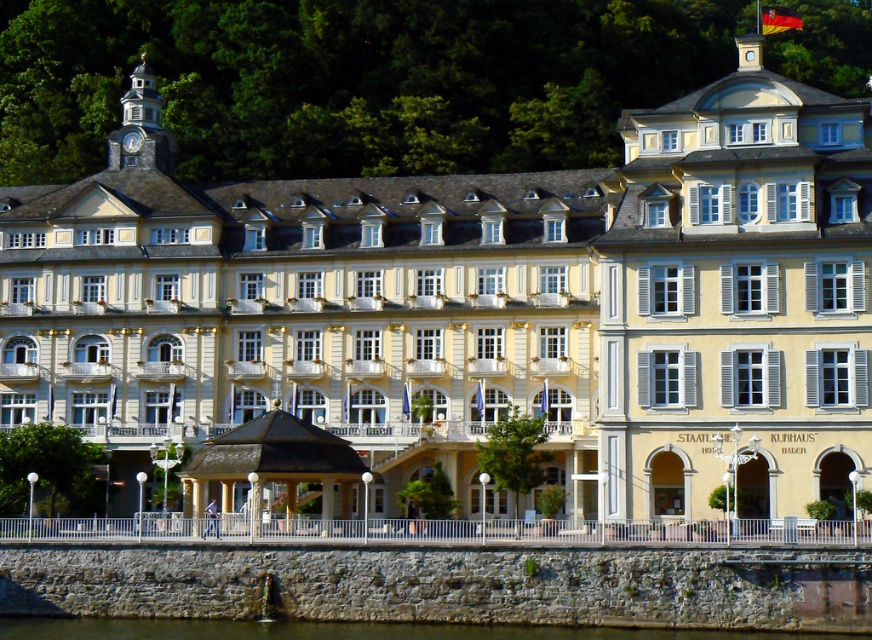
In the scene shown: You are standing at the point marked as point (351, 630) in the image. What is the surface you are currently standing on?

The point (351, 630) is on clear water at lower center, so you are standing on clear water at lower center.

Based on the scene, if you were to compare the width of the clear water at lower center and the stone clock tower at upper left, which one is wider?

The clear water at lower center is wider than the stone clock tower at upper left.

You are an architect reviewing blueprints of a waterfront building. You notice two elements in the design, the clear water at lower center and the stone clock tower at upper left. Which element has a larger size in the blueprint?

The stone clock tower at upper left is larger than the clear water at lower center.